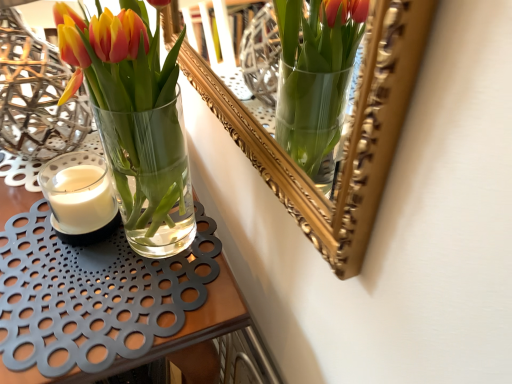
What do you see at coordinates (112, 304) in the screenshot? Image resolution: width=512 pixels, height=384 pixels. I see `clear glass vase at center` at bounding box center [112, 304].

Where is `clear glass vase at center`? This screenshot has width=512, height=384. clear glass vase at center is located at coordinates click(x=112, y=304).

What is the approximate width of clear glass vase at center?

The width of clear glass vase at center is 21.74 inches.

In order to face white matte candle at left, should I rotate leftwards or rightwards?

To align with it, rotate left about 22.649°.

What do you see at coordinates (81, 199) in the screenshot? The image size is (512, 384). I see `white matte candle at left` at bounding box center [81, 199].

You are a GUI agent. You are given a task and a screenshot of the screen. Output one action in this format:
    pyautogui.click(x=<x>, y=<y>)
    Task: Click on the white matte candle at left
    The width and height of the screenshot is (512, 384).
    Given the screenshot: What is the action you would take?
    pyautogui.click(x=81, y=199)

Where is `clear glass vase at center`? The height and width of the screenshot is (384, 512). clear glass vase at center is located at coordinates click(112, 304).

Does clear glass vase at center appear on the left side of white matte candle at left?

Indeed, clear glass vase at center is positioned on the left side of white matte candle at left.

Does clear glass vase at center come in front of white matte candle at left?

Yes, the depth of clear glass vase at center is less than that of white matte candle at left.

Which point is more distant from viewer, (104,266) or (113,202)?

The point (113,202) is behind.

From the image's perspective, is clear glass vase at center positioned above or below white matte candle at left?

clear glass vase at center is situated lower than white matte candle at left in the image.

Consider the image. From a real-world perspective, who is located lower, clear glass vase at center or white matte candle at left?

clear glass vase at center.

Which object is wider, clear glass vase at center or white matte candle at left?

Wider between the two is clear glass vase at center.

Between clear glass vase at center and white matte candle at left, which one has more height?

Standing taller between the two is clear glass vase at center.

Who is smaller, clear glass vase at center or white matte candle at left?

Smaller between the two is white matte candle at left.

Could white matte candle at left be considered to be inside clear glass vase at center?

No.

Is the surface of clear glass vase at center in direct contact with white matte candle at left?

No.

Is clear glass vase at center facing towards white matte candle at left?

No, clear glass vase at center is not aimed at white matte candle at left.

How different are the orientations of clear glass vase at center and white matte candle at left in degrees?

clear glass vase at center and white matte candle at left are facing 1.01 degrees away from each other.

In the scene shown: How distant is clear glass vase at center from white matte candle at left?

clear glass vase at center is 5.04 inches away from white matte candle at left.

The height and width of the screenshot is (384, 512). Find the location of `candle behind the clear glass vase at center`. candle behind the clear glass vase at center is located at coordinates (81, 199).

From the picture: Based on their positions, is white matte candle at left located to the left or right of clear glass vase at center?

In the image, white matte candle at left appears on the right side of clear glass vase at center.

In the image, is white matte candle at left positioned in front of or behind clear glass vase at center?

white matte candle at left is positioned farther from the viewer than clear glass vase at center.

Is point (108, 183) closer or farther from the camera than point (94, 303)?

Clearly, point (108, 183) is more distant from the camera than point (94, 303).

Consider the image. From the image's perspective, between white matte candle at left and clear glass vase at center, who is located below?

clear glass vase at center.

From a real-world perspective, which object rests below the other?

From a 3D spatial view, clear glass vase at center is below.

Which object is wider, white matte candle at left or clear glass vase at center?

Wider between the two is clear glass vase at center.

Considering the relative sizes of white matte candle at left and clear glass vase at center in the image provided, is white matte candle at left taller than clear glass vase at center?

No.

Considering the relative sizes of white matte candle at left and clear glass vase at center in the image provided, is white matte candle at left bigger than clear glass vase at center?

No, white matte candle at left is not bigger than clear glass vase at center.

Is white matte candle at left inside the boundaries of clear glass vase at center, or outside?

white matte candle at left exists outside the volume of clear glass vase at center.

Would you consider white matte candle at left to be distant from clear glass vase at center?

No.

Is white matte candle at left facing away from clear glass vase at center?

No, white matte candle at left is not facing the opposite direction of clear glass vase at center.

Measure the distance from white matte candle at left to clear glass vase at center.

They are 5.04 inches apart.

Find the location of a particular element. candle above the clear glass vase at center (from a real-world perspective) is located at coordinates (81, 199).

At what (x,y) coordinates should I click in order to perform the action: click on table in front of the white matte candle at left. Please return your answer as a coordinate pair (x, y). Looking at the image, I should click on (112, 304).

You are a GUI agent. You are given a task and a screenshot of the screen. Output one action in this format:
    pyautogui.click(x=<x>, y=<y>)
    Task: Click on the candle on the right of clear glass vase at center
    This screenshot has width=512, height=384.
    Given the screenshot: What is the action you would take?
    pyautogui.click(x=81, y=199)